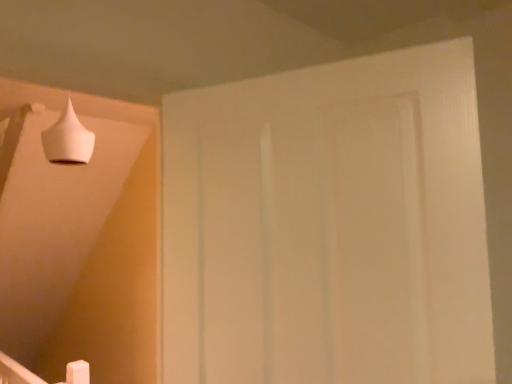
Question: Is the depth of white matte door at center greater than that of white matte cone at upper left?

Choices:
 (A) yes
 (B) no

Answer: (B)

Question: Is white matte door at center in contact with white matte cone at upper left?

Choices:
 (A) yes
 (B) no

Answer: (B)

Question: From the image's perspective, would you say white matte door at center is shown under white matte cone at upper left?

Choices:
 (A) yes
 (B) no

Answer: (A)

Question: Is white matte door at center not close to white matte cone at upper left?

Choices:
 (A) yes
 (B) no

Answer: (A)

Question: Is white matte door at center smaller than white matte cone at upper left?

Choices:
 (A) yes
 (B) no

Answer: (B)

Question: Is white matte door at center aimed at white matte cone at upper left?

Choices:
 (A) no
 (B) yes

Answer: (A)

Question: Is white matte cone at upper left facing away from white matte door at center?

Choices:
 (A) no
 (B) yes

Answer: (B)

Question: Could you tell me if white matte cone at upper left is turned towards white matte door at center?

Choices:
 (A) yes
 (B) no

Answer: (B)

Question: Considering the relative positions of white matte cone at upper left and white matte door at center in the image provided, is white matte cone at upper left to the left of white matte door at center from the viewer's perspective?

Choices:
 (A) no
 (B) yes

Answer: (B)

Question: Are white matte cone at upper left and white matte door at center far apart?

Choices:
 (A) no
 (B) yes

Answer: (B)

Question: Is white matte door at center surrounded by white matte cone at upper left?

Choices:
 (A) no
 (B) yes

Answer: (A)

Question: Is white matte cone at upper left located outside white matte door at center?

Choices:
 (A) yes
 (B) no

Answer: (A)

Question: In terms of width, does white matte door at center look wider or thinner when compared to white matte cone at upper left?

Choices:
 (A) thin
 (B) wide

Answer: (A)